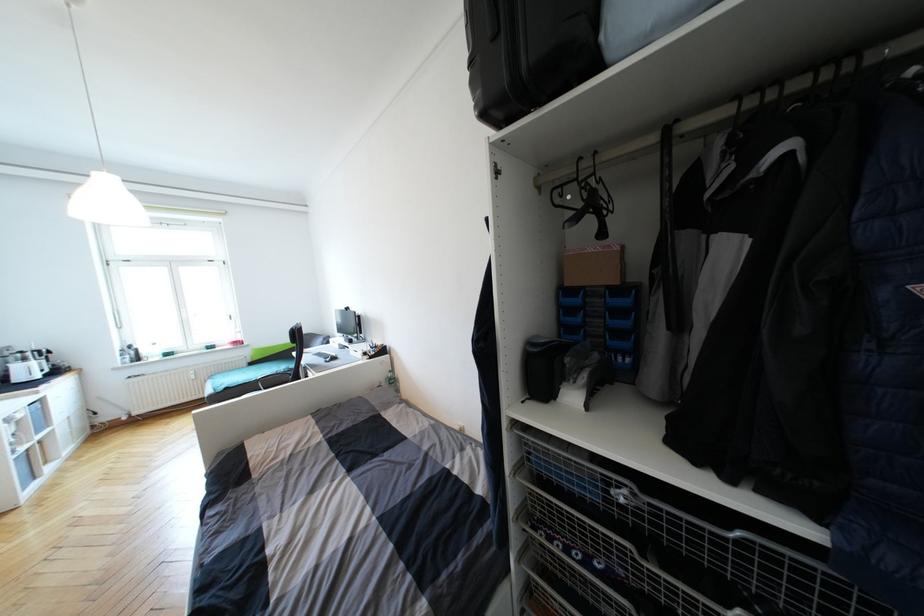
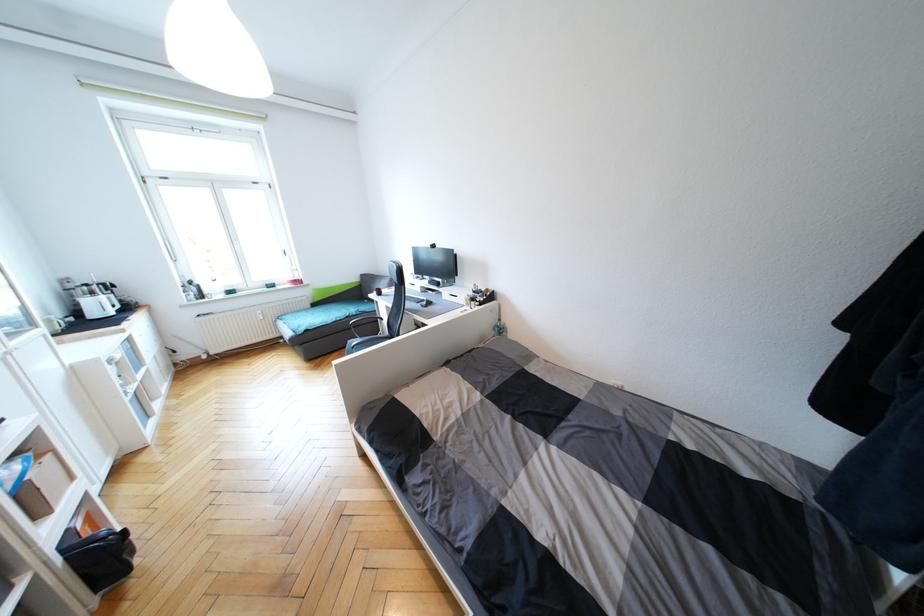
The point at (x=61, y=373) is marked in the first image. Where is the corresponding point in the second image?

(130, 309)